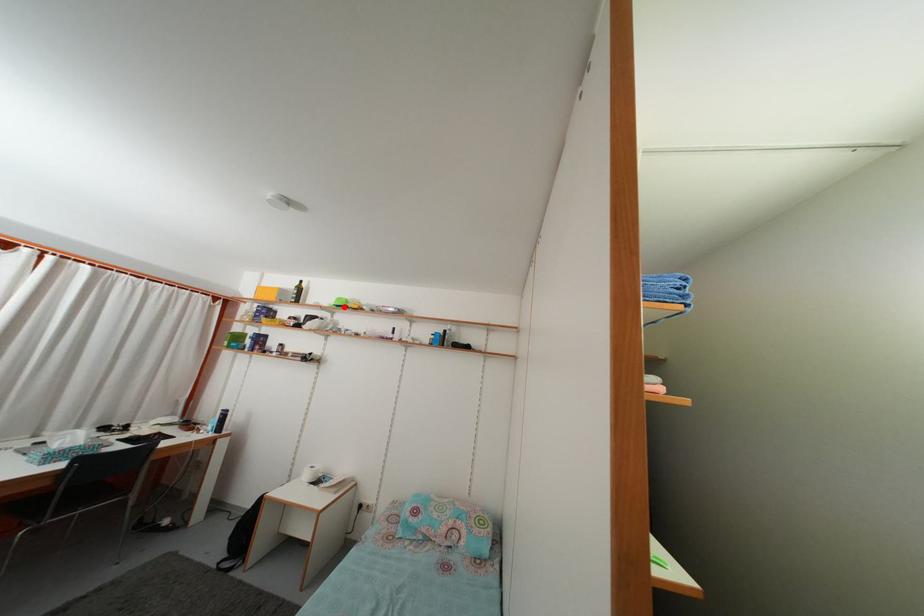
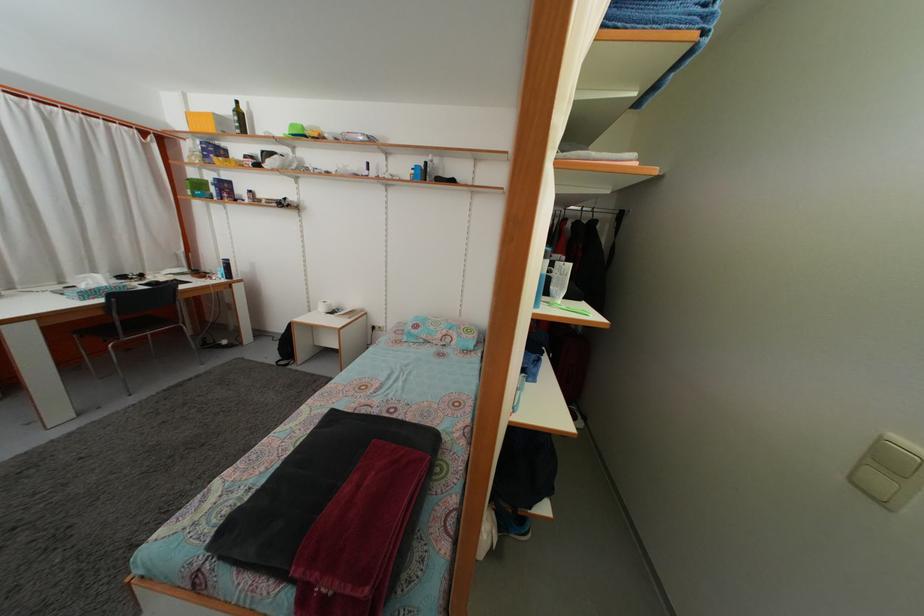
Where in the second image is the point corresponding to the highlighted location from the first image?

(298, 132)